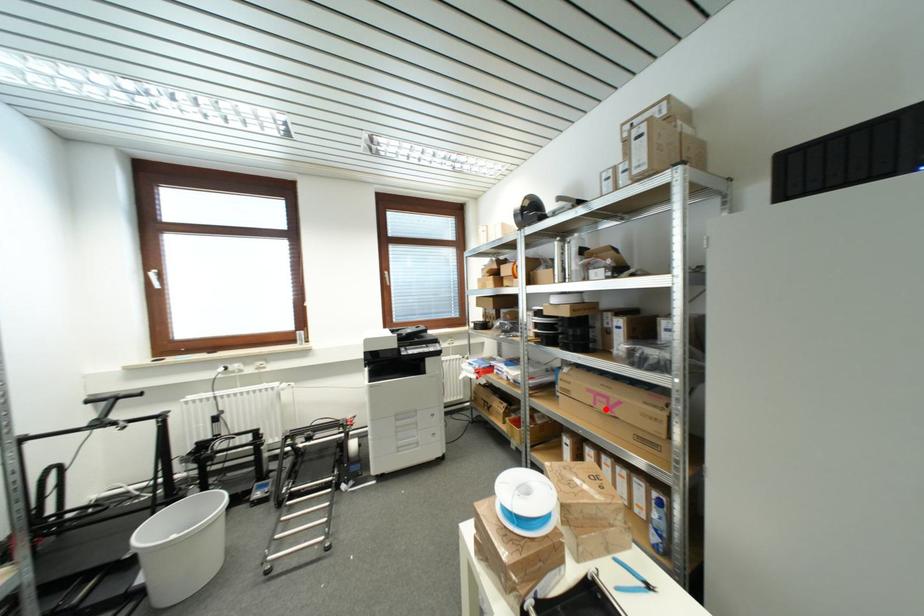
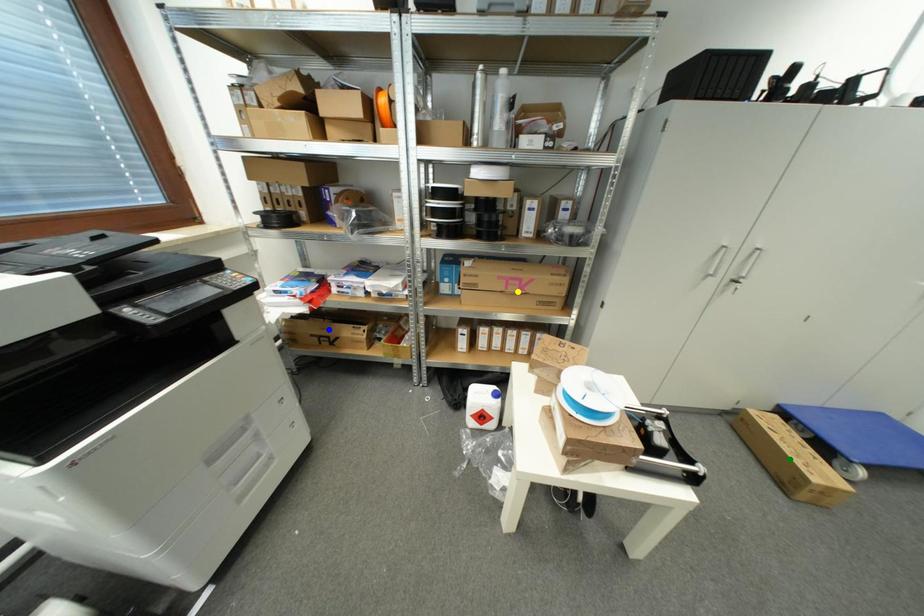
Question: I am providing you with two images of the same scene from different viewpoints. A red point is marked on the first image. You are given multiple points on the second image. Which mark in image 2 goes with the point in image 1?

Choices:
 (A) blue point
 (B) green point
 (C) yellow point

Answer: (C)